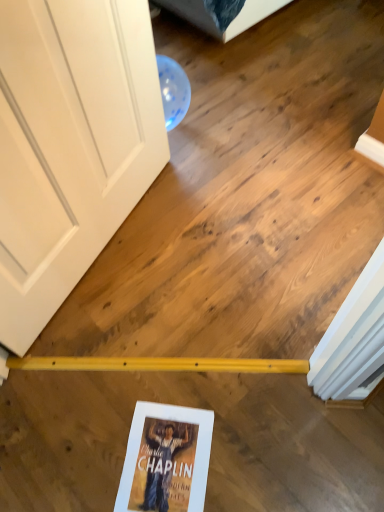
Find the location of a particular element. This screenshot has width=384, height=512. vacant area located to the right-hand side of white matte door at upper left is located at coordinates (219, 238).